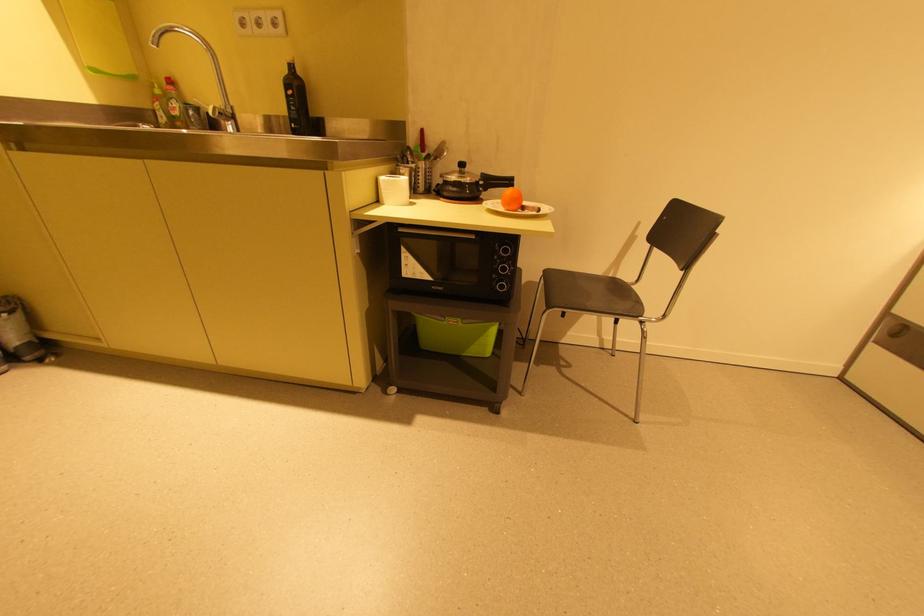
Find where to lift the knife handle. Please return your answer as a coordinate pair (x, y).

(421, 140)